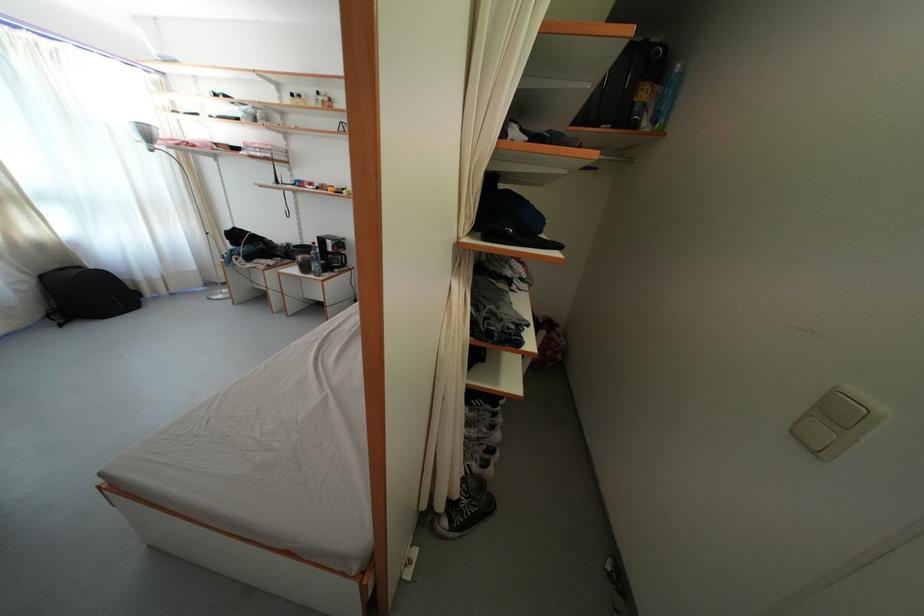
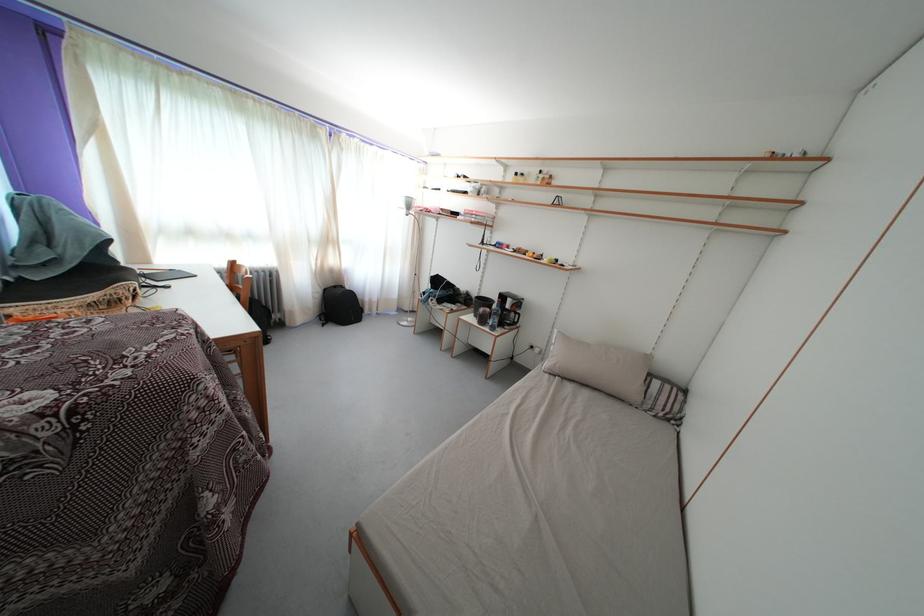
Question: The first image is from the beginning of the video and the second image is from the end. How did the camera likely rotate when shooting the video?

Choices:
 (A) Left
 (B) Right
 (C) Up
 (D) Down

Answer: (A)